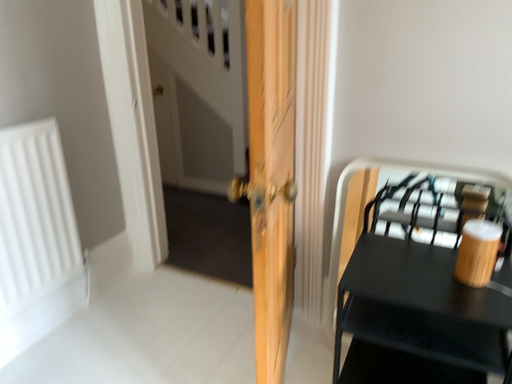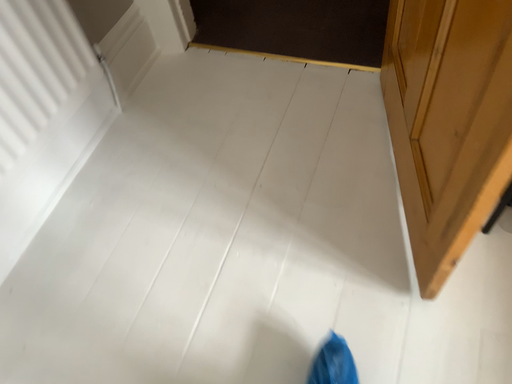
Question: Which way did the camera rotate in the video?

Choices:
 (A) rotated downward
 (B) rotated upward

Answer: (A)